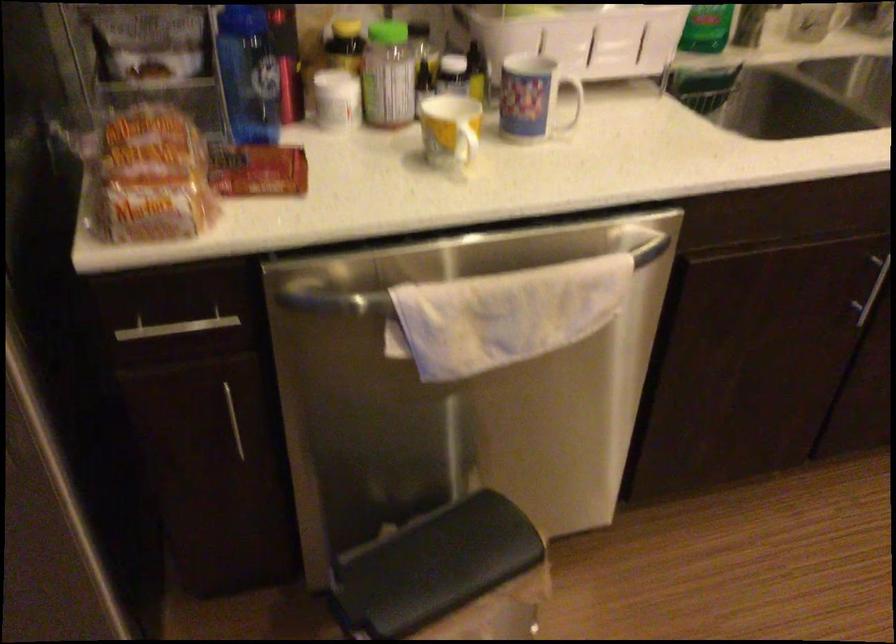
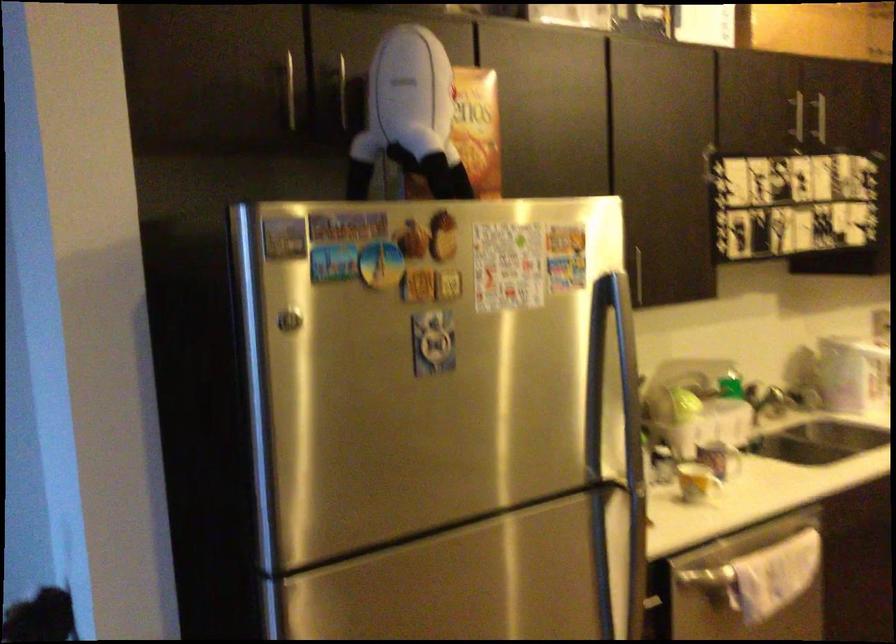
In the second image, find the point that corresponds to the point at 488,327 in the first image.

(752, 594)